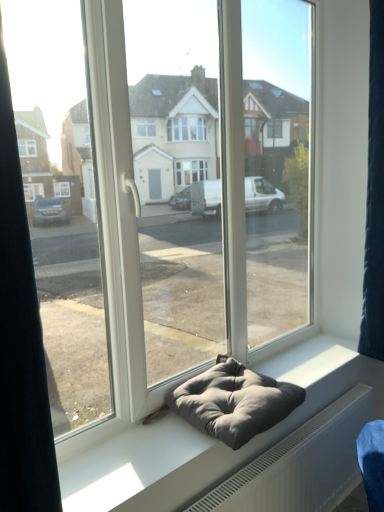
Question: Is gray fabric bean bag at center turned away from gray fabric cushion at center?

Choices:
 (A) no
 (B) yes

Answer: (A)

Question: From the image's perspective, is gray fabric bean bag at center above gray fabric cushion at center?

Choices:
 (A) no
 (B) yes

Answer: (B)

Question: Does gray fabric bean bag at center appear on the left side of gray fabric cushion at center?

Choices:
 (A) no
 (B) yes

Answer: (B)

Question: Is gray fabric bean bag at center facing towards gray fabric cushion at center?

Choices:
 (A) yes
 (B) no

Answer: (B)

Question: From the image's perspective, would you say gray fabric bean bag at center is shown under gray fabric cushion at center?

Choices:
 (A) yes
 (B) no

Answer: (B)

Question: Is transparent glass door at center wider or thinner than dark blue fabric at right?

Choices:
 (A) thin
 (B) wide

Answer: (A)

Question: Looking at the image, does transparent glass door at center seem bigger or smaller compared to dark blue fabric at right?

Choices:
 (A) small
 (B) big

Answer: (B)

Question: Is point (223, 31) positioned closer to the camera than point (370, 35)?

Choices:
 (A) closer
 (B) farther

Answer: (A)

Question: Do you think transparent glass door at center is within dark blue fabric at right, or outside of it?

Choices:
 (A) inside
 (B) outside

Answer: (B)

Question: Is transparent glass door at center to the left or to the right of gray fabric bean bag at center in the image?

Choices:
 (A) right
 (B) left

Answer: (B)

Question: Looking at their shapes, would you say transparent glass door at center is wider or thinner than gray fabric bean bag at center?

Choices:
 (A) thin
 (B) wide

Answer: (A)

Question: In terms of size, does transparent glass door at center appear bigger or smaller than gray fabric bean bag at center?

Choices:
 (A) big
 (B) small

Answer: (A)

Question: Is transparent glass door at center in front of or behind gray fabric bean bag at center in the image?

Choices:
 (A) front
 (B) behind

Answer: (A)

Question: Is gray fabric cushion at center in front of or behind gray fabric bean bag at center in the image?

Choices:
 (A) behind
 (B) front

Answer: (B)

Question: Based on their positions, is gray fabric cushion at center located to the left or right of gray fabric bean bag at center?

Choices:
 (A) right
 (B) left

Answer: (A)